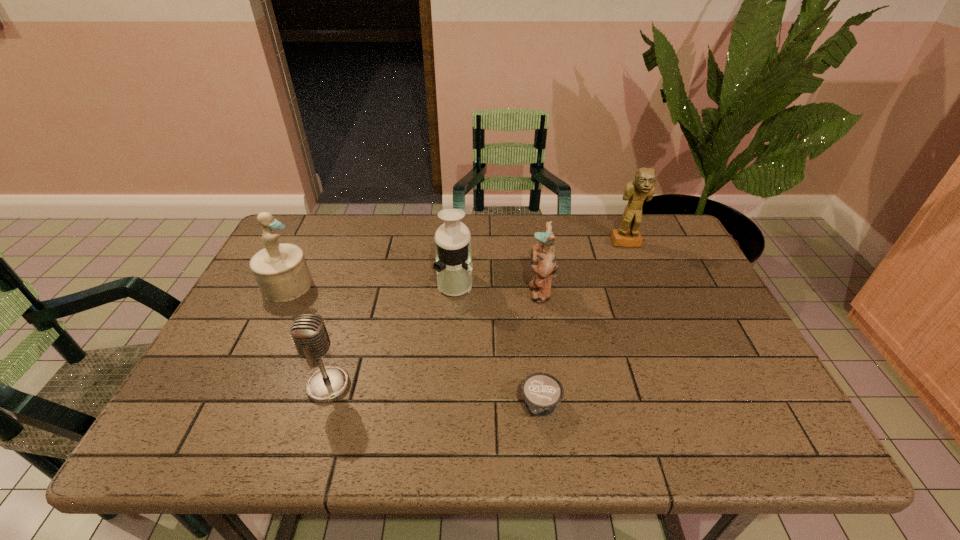
This screenshot has height=540, width=960. I want to click on the rightmost object, so click(642, 188).

Locate an element on the screen. The height and width of the screenshot is (540, 960). the farthest object is located at coordinates (642, 188).

Locate an element on the screen. juicer is located at coordinates (453, 265).

The width and height of the screenshot is (960, 540). I want to click on the leftmost object, so click(281, 271).

Find the location of a particular element. the second figurine from left to right is located at coordinates (543, 260).

Where is `microphone`? This screenshot has height=540, width=960. microphone is located at coordinates (309, 333).

In order to click on yogurt in this screenshot , I will do `click(542, 392)`.

At what (x,y) coordinates should I click in order to perform the action: click on free space located 0.220m on the front-facing side of the farthest object. Please return your answer as a coordinate pair (x, y). The height and width of the screenshot is (540, 960). Looking at the image, I should click on (650, 299).

Identify the location of vacant space situated on the left of the fourth object from right to left. This screenshot has width=960, height=540. (334, 282).

Where is `free space located at the beak of the leftmost figurine`? The height and width of the screenshot is (540, 960). free space located at the beak of the leftmost figurine is located at coordinates (329, 285).